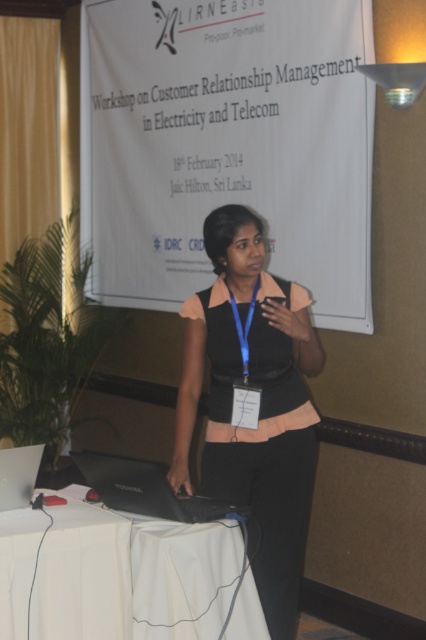
Is white cloth-covered table at lower center positioned at the back of black matte laptop at lower center?

No, it is not.

Does white cloth-covered table at lower center appear under black matte laptop at lower center?

Indeed, white cloth-covered table at lower center is positioned under black matte laptop at lower center.

Does point (181, 636) lie in front of point (192, 497)?

Yes.

The image size is (426, 640). Identify the location of white cloth-covered table at lower center. (132, 576).

Is black matte laptop at lower center wider than silver metallic laptop at lower left?

Correct, the width of black matte laptop at lower center exceeds that of silver metallic laptop at lower left.

Can you confirm if black matte laptop at lower center is positioned above silver metallic laptop at lower left?

No, black matte laptop at lower center is not above silver metallic laptop at lower left.

The height and width of the screenshot is (640, 426). Describe the element at coordinates (146, 490) in the screenshot. I see `black matte laptop at lower center` at that location.

Identify the location of black matte laptop at lower center. Image resolution: width=426 pixels, height=640 pixels. (146, 490).

Which of these two, black matte vest at center or black matte laptop at lower center, stands taller?

black matte vest at center is taller.

Which is more to the right, black matte vest at center or black matte laptop at lower center?

Positioned to the right is black matte vest at center.

Is point (310, 438) in front of point (184, 500)?

That is False.

What are the coordinates of `black matte vest at center` in the screenshot? It's located at (259, 404).